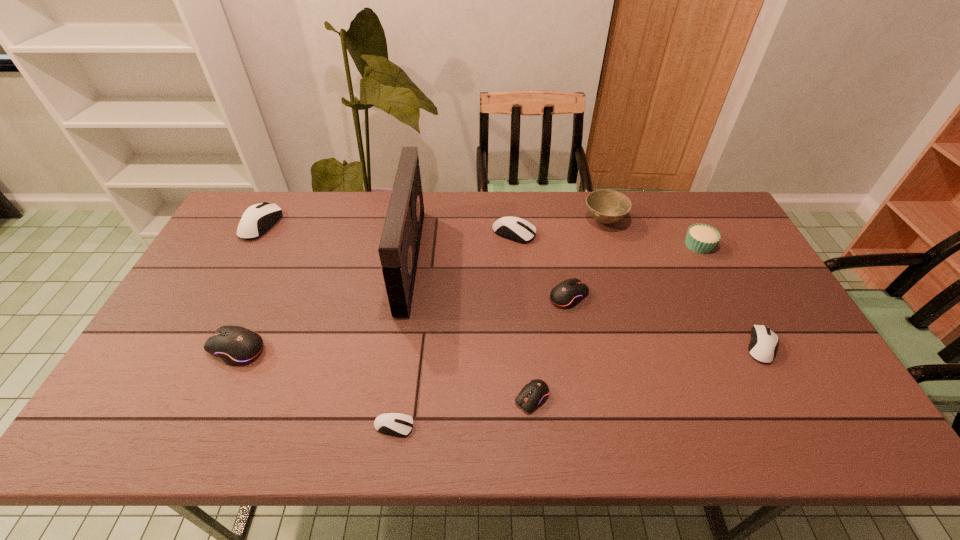
Locate an element on the screen. the fourth object from right to left is located at coordinates (567, 294).

Locate an element on the screen. This screenshot has width=960, height=540. the rightmost mouse is located at coordinates (763, 344).

Identify the location of the third biggest white mouse. (763, 344).

Locate an element on the screen. The image size is (960, 540). the nearest black computer mouse is located at coordinates (535, 393).

I want to click on the smallest black computer mouse, so click(535, 393).

Find the location of a particular element. the shortest mouse is located at coordinates (395, 424).

Find the location of a particular element. the third mouse from left to right is located at coordinates (395, 424).

This screenshot has width=960, height=540. Identify the location of free space located 0.330m on the front side of the videotape. (523, 260).

Locate an element on the screen. The width and height of the screenshot is (960, 540). vacant space situated 0.360m on the front of the bowl is located at coordinates click(635, 320).

Identify the location of free point located on the front of the leftmost white mouse. (235, 272).